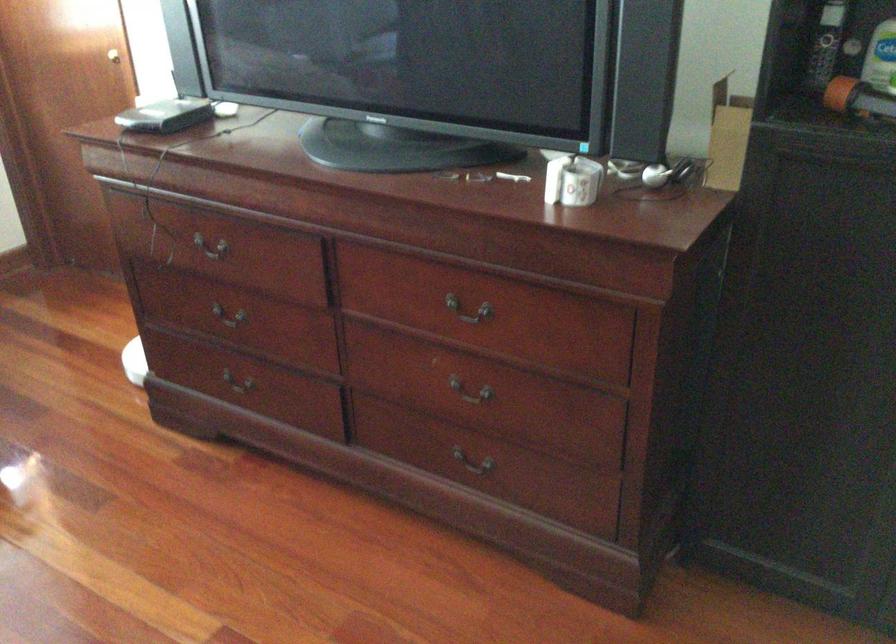
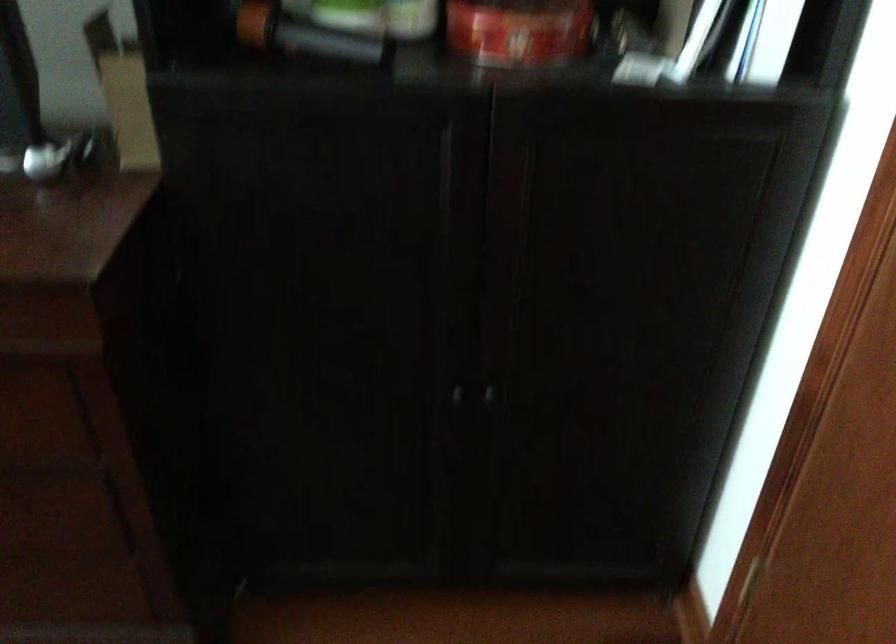
Question: How did the camera likely rotate?

Choices:
 (A) Left
 (B) Right
 (C) Up
 (D) Down

Answer: (B)